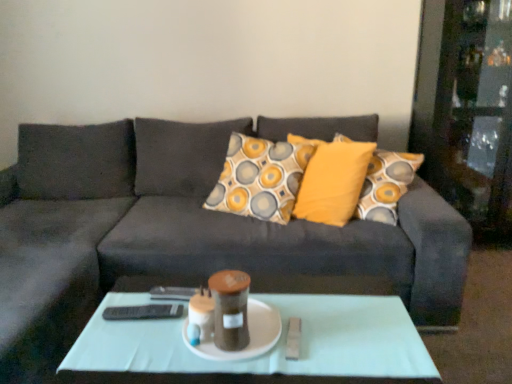
Find the location of `blank space situated above light green glass coffee table at center (from a real-world perspective)`. blank space situated above light green glass coffee table at center (from a real-world perspective) is located at coordinates (263, 334).